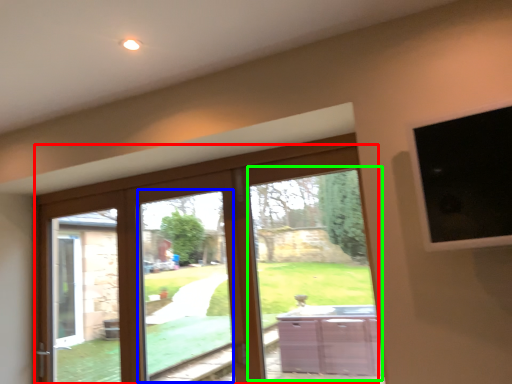
Question: Which object is positioned closest to door (highlighted by a red box)? Select from window (highlighted by a blue box) and bay window (highlighted by a green box).

Choices:
 (A) window
 (B) bay window

Answer: (B)